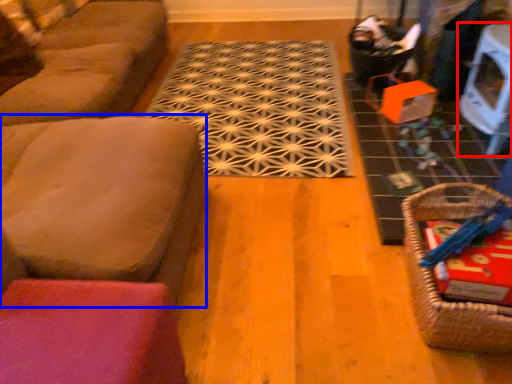
Question: Which of the following is the farthest to the observer, table (highlighted by a red box) or couch (highlighted by a blue box)?

Choices:
 (A) table
 (B) couch

Answer: (A)